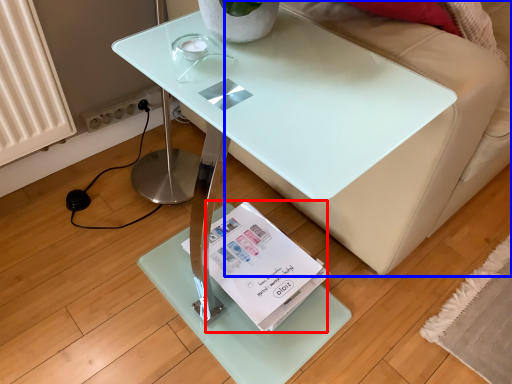
Question: Which object is further to the camera taking this photo, magazine (highlighted by a red box) or couch (highlighted by a blue box)?

Choices:
 (A) magazine
 (B) couch

Answer: (A)